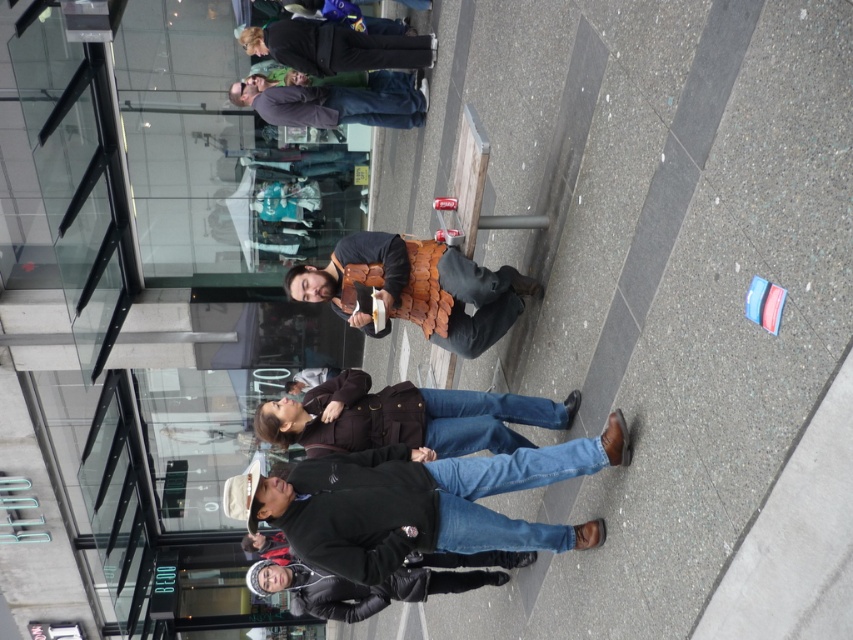
Question: Is brown leather armor at center to the left of brown leather vest at upper center from the viewer's perspective?

Choices:
 (A) yes
 (B) no

Answer: (B)

Question: Which point is farther to the camera?

Choices:
 (A) brown leather armor at center
 (B) black leather jacket at lower center

Answer: (B)

Question: Which of the following is the farthest from the observer?

Choices:
 (A) (468, 588)
 (B) (289, 120)
 (C) (523, 456)
 (D) (254, 49)

Answer: (B)

Question: Which is nearer to the black leather pants at upper center?

Choices:
 (A) black leather jacket at lower center
 (B) brown leather armor at center
 (C) dark brown leather jacket at lower center
 (D) brown leather jacket at center

Answer: (B)

Question: Is brown leather jacket at center behind brown leather vest at upper center?

Choices:
 (A) no
 (B) yes

Answer: (A)

Question: Is brown leather armor at center positioned before brown leather vest at upper center?

Choices:
 (A) yes
 (B) no

Answer: (A)